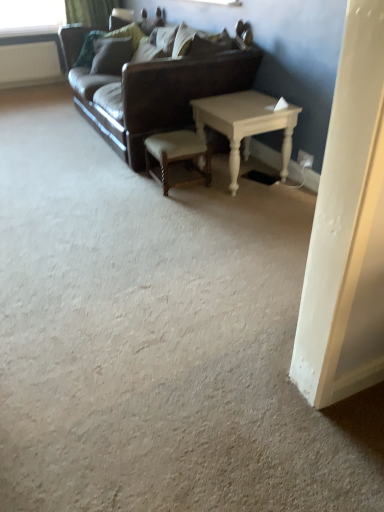
I want to click on free space in front of white wood table at center, so point(248,209).